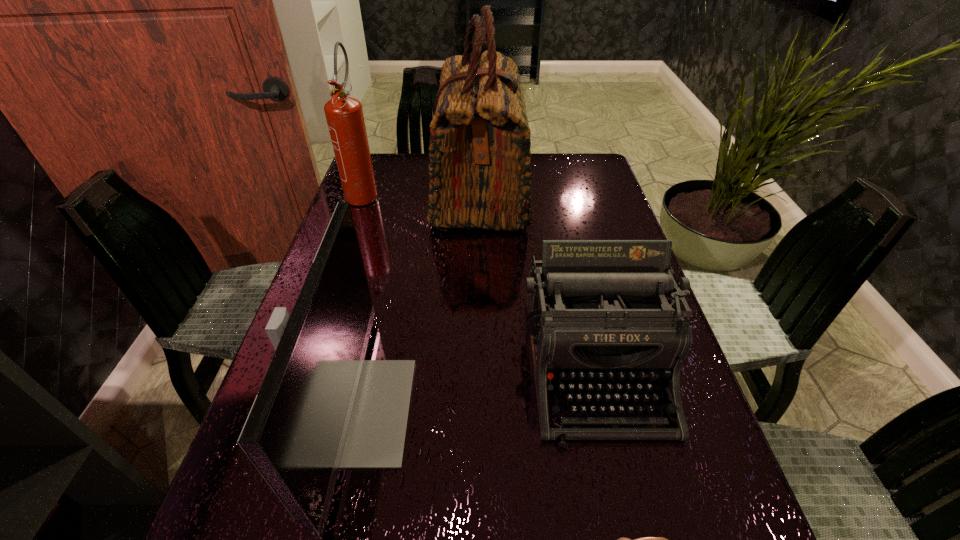
This screenshot has height=540, width=960. Identify the location of object that is at the left edge. (344, 114).

The image size is (960, 540). I want to click on object present at the right edge, so click(595, 318).

Image resolution: width=960 pixels, height=540 pixels. I want to click on object at the far left corner, so (x=344, y=114).

Identify the location of free space at the left edge of the desktop. This screenshot has height=540, width=960. (367, 244).

Locate an element on the screen. The height and width of the screenshot is (540, 960). vacant area at the far left corner of the desktop is located at coordinates (375, 165).

Image resolution: width=960 pixels, height=540 pixels. What are the coordinates of `vacant space at the far right corner` in the screenshot? It's located at (591, 157).

Identify the location of free area in between the second shortest object and the second tallest object. The image size is (960, 540). (479, 278).

You are a GUI agent. You are given a task and a screenshot of the screen. Output one action in this format:
    pyautogui.click(x=<x>, y=<y>)
    Task: Click on the vacant area that lies between the fire extinguisher and the tallest object
    The height and width of the screenshot is (540, 960).
    Given the screenshot: What is the action you would take?
    pyautogui.click(x=422, y=192)

Where is `empty space between the typewriter and the second tallest object`? This screenshot has width=960, height=540. empty space between the typewriter and the second tallest object is located at coordinates (479, 278).

Locate which object ranks second in proximity to the typewriter. Please provide its 2D coordinates. Your answer should be formatted as a tuple, i.e. [(x, y)], where the tuple contains the x and y coordinates of a point satisfying the conditions above.

[(321, 406)]